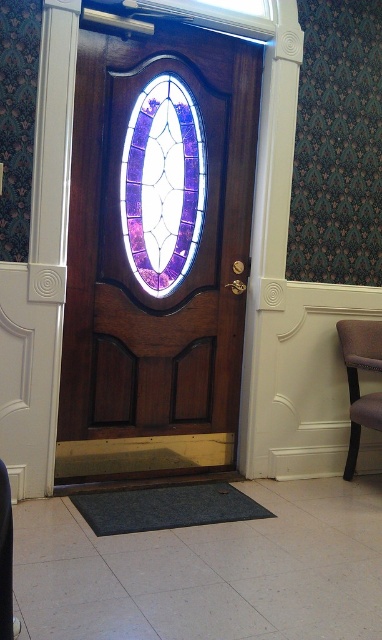
In the scene shown: Does polished wood door at center have a larger size compared to velvet brown chair at right?

Yes.

The height and width of the screenshot is (640, 382). What do you see at coordinates (157, 236) in the screenshot?
I see `polished wood door at center` at bounding box center [157, 236].

Where is `polished wood door at center`? polished wood door at center is located at coordinates (157, 236).

Describe the element at coordinates (163, 186) in the screenshot. I see `purple stained glass at center` at that location.

Measure the distance from purple stained glass at center to velvet brown chair at right.

purple stained glass at center is 4.35 feet away from velvet brown chair at right.

Between point (163, 116) and point (367, 403), which one is positioned behind?

Point (367, 403)

You are a GUI agent. You are given a task and a screenshot of the screen. Output one action in this format:
    pyautogui.click(x=<x>, y=<y>)
    Task: Click on the purple stained glass at center
    The width and height of the screenshot is (382, 640).
    Given the screenshot: What is the action you would take?
    pyautogui.click(x=163, y=186)

Is point (121, 323) farther from camera compared to point (144, 115)?

Yes, it is.

Which of these two, polished wood door at center or purple stained glass at center, stands shorter?

purple stained glass at center

Identify the location of polished wood door at center. coord(157,236).